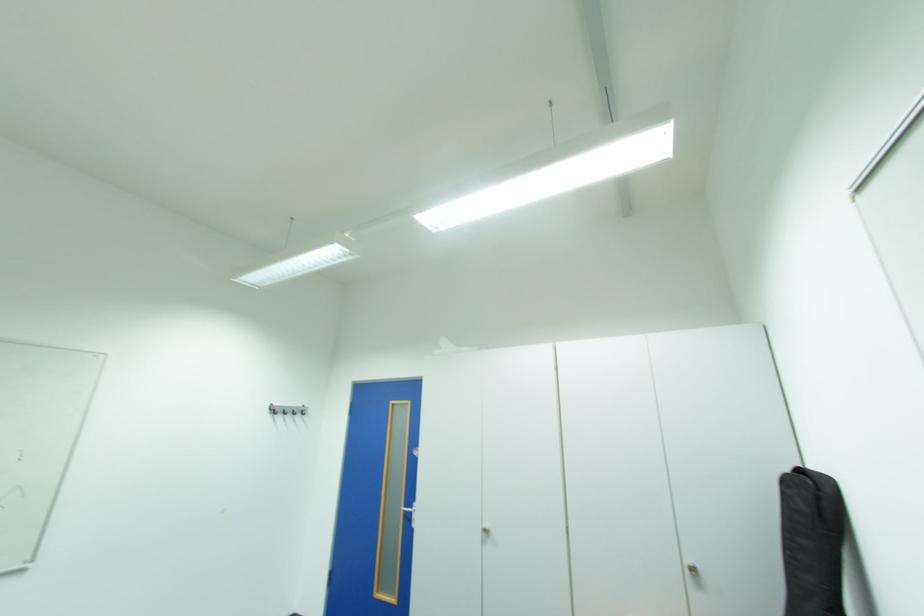
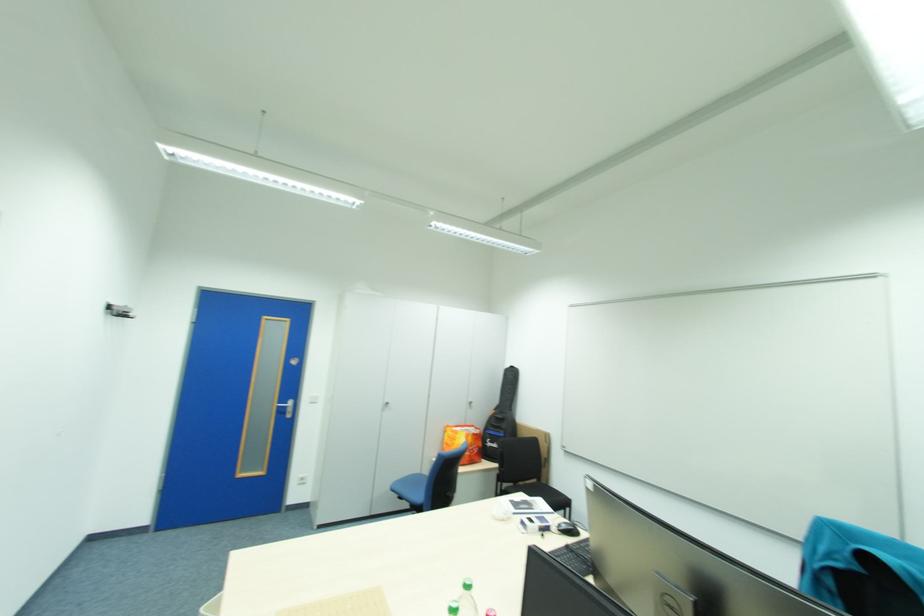
Locate, in the second image, the point that corresponds to [702,572] in the first image.

(479, 403)